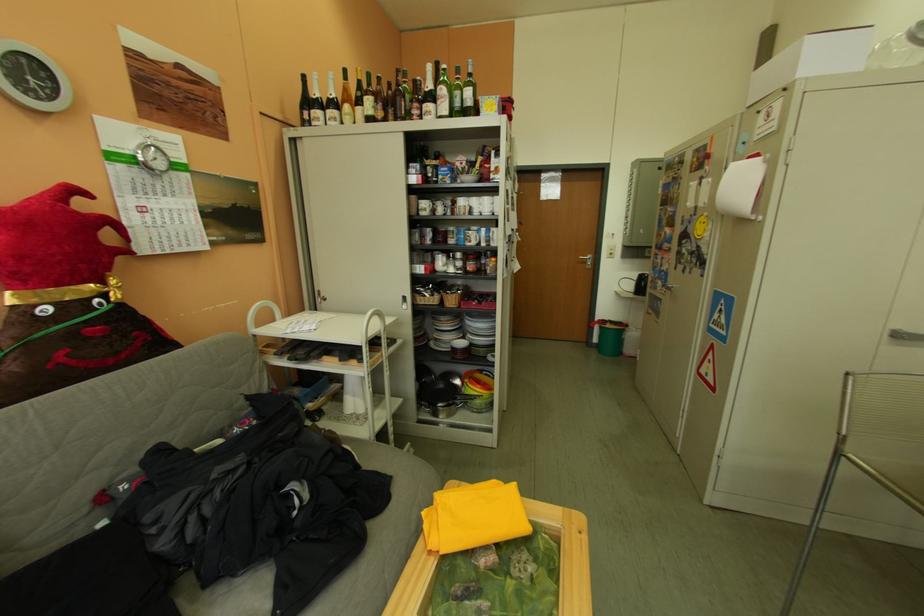
Find the location of a particular element. Image resolution: width=924 pixels, height=616 pixels. metal cabinet handle is located at coordinates (905, 334).